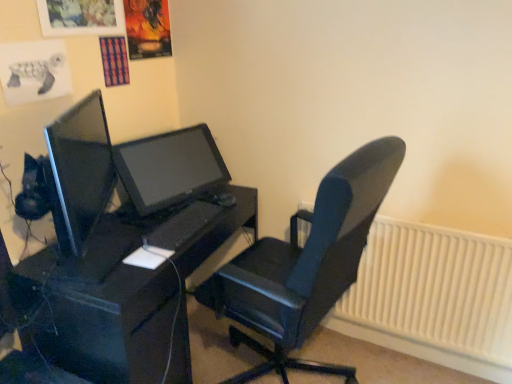
Identify the location of black matte keyboard at center. (182, 226).

Measure the distance between point (106, 239) and camera.

The depth of point (106, 239) is 5.34 feet.

You are a GUI agent. You are given a task and a screenshot of the screen. Output one action in this format:
    pyautogui.click(x=<x>, y=<y>)
    Task: Click on the black matte desk at center
    
    Given the screenshot: What is the action you would take?
    pyautogui.click(x=119, y=299)

Locate an element on the screen. Image resolution: width=512 pixels, height=384 pixels. white plastic radiator at lower right is located at coordinates (432, 295).

Is black matte desk at center oriented towards black leather chair at center?

Yes, black matte desk at center is turned towards black leather chair at center.

Which object is thinner, black matte desk at center or black leather chair at center?

With smaller width is black matte desk at center.

Is black matte desk at center at the left side of black leather chair at center?

Indeed, black matte desk at center is positioned on the left side of black leather chair at center.

Which of these two, matte black monitor at center or black leather chair at center, is wider?

With larger width is black leather chair at center.

Considering the positions of points (148, 165) and (264, 244), is point (148, 165) closer to camera compared to point (264, 244)?

Yes, it is.

Looking at this image, is matte black monitor at center not close to black leather chair at center?

matte black monitor at center is actually quite close to black leather chair at center.

Considering the positions of objects matte black monitor at center and black leather chair at center in the image provided, who is behind, matte black monitor at center or black leather chair at center?

matte black monitor at center is behind.

Considering the sizes of objects black matte desk at center and matte black monitor at center in the image provided, who is smaller, black matte desk at center or matte black monitor at center?

With smaller size is matte black monitor at center.

Is black matte desk at center aimed at matte black monitor at center?

No, black matte desk at center is not oriented towards matte black monitor at center.

Would you say black matte desk at center is outside matte black monitor at center?

Yes, black matte desk at center is outside of matte black monitor at center.

Is white plastic radiator at lower right at the back of matte black monitor at center?

No, matte black monitor at center is not facing away from white plastic radiator at lower right.

Is matte black monitor at center far from white plastic radiator at lower right?

matte black monitor at center is positioned a significant distance from white plastic radiator at lower right.

Is matte black monitor at center taller or shorter than white plastic radiator at lower right?

Considering their sizes, matte black monitor at center has less height than white plastic radiator at lower right.

Is the position of matte black monitor at center less distant than that of white plastic radiator at lower right?

That is True.

Is white plastic radiator at lower right wider or thinner than black matte desk at center?

In the image, white plastic radiator at lower right appears to be more narrow than black matte desk at center.

Which point is more distant from viewer, (426, 337) or (114, 378)?

The point (426, 337) is behind.

From a real-world perspective, is white plastic radiator at lower right over black matte desk at center?

No, from a real-world perspective, white plastic radiator at lower right is not on top of black matte desk at center.

This screenshot has width=512, height=384. Identify the location of chair that is on the left side of white plastic radiator at lower right. (304, 265).

Based on the photo, which of these two, white plastic radiator at lower right or black leather chair at center, stands shorter?

white plastic radiator at lower right.

Is point (497, 355) more distant than point (343, 160)?

Yes, it is.

Consider the image. How distant is white plastic radiator at lower right from black leather chair at center?

white plastic radiator at lower right is 19.21 inches away from black leather chair at center.

From the image's perspective, which object appears higher, black leather chair at center or black matte desk at center?

black leather chair at center is shown above in the image.

Does black leather chair at center have a greater height compared to black matte desk at center?

Yes.

Can you tell me how much black leather chair at center and black matte desk at center differ in facing direction?

black leather chair at center and black matte desk at center are facing 172 degrees away from each other.

Does black leather chair at center come behind black matte desk at center?

No, black leather chair at center is closer to the viewer.

Find the location of a particular element. desk behind the black leather chair at center is located at coordinates click(119, 299).

Where is `computer monitor above the black leather chair at center (from a real-world perspective)`? This screenshot has width=512, height=384. computer monitor above the black leather chair at center (from a real-world perspective) is located at coordinates (169, 168).

When comparing their distances from black matte keyboard at center, does matte black monitor at center or black leather chair at center seem further?

black leather chair at center lies further to black matte keyboard at center than the other object.

From the image, which object appears to be nearer to black leather chair at center, matte black monitor at center or white plastic radiator at lower right?

white plastic radiator at lower right is closer to black leather chair at center.

Considering their positions, is black matte keyboard at center positioned further to black leather chair at center than black matte desk at center?

Based on the image, black matte keyboard at center appears to be further to black leather chair at center.

Considering their positions, is black matte keyboard at center positioned closer to black matte desk at center than matte black monitor at center?

black matte keyboard at center lies closer to black matte desk at center than the other object.

From the picture: Estimate the real-world distances between objects in this image. Which object is closer to white plastic radiator at lower right, black matte keyboard at center or black leather chair at center?

black leather chair at center lies closer to white plastic radiator at lower right than the other object.

Based on their spatial positions, is white plastic radiator at lower right or black leather chair at center further from matte black monitor at center?

white plastic radiator at lower right.

Considering their positions, is black matte desk at center positioned further to black matte keyboard at center than black leather chair at center?

black leather chair at center is further to black matte keyboard at center.

From the image, which object appears to be nearer to white plastic radiator at lower right, black leather chair at center or black matte desk at center?

The object closer to white plastic radiator at lower right is black leather chair at center.

Locate an element on the screen. The height and width of the screenshot is (384, 512). computer monitor situated between black matte desk at center and white plastic radiator at lower right from left to right is located at coordinates (169, 168).

This screenshot has height=384, width=512. I want to click on chair between black matte keyboard at center and white plastic radiator at lower right in the horizontal direction, so click(304, 265).

Where is `keyboard located between matte black monitor at center and black leather chair at center in the left-right direction`? This screenshot has width=512, height=384. keyboard located between matte black monitor at center and black leather chair at center in the left-right direction is located at coordinates (182, 226).

The image size is (512, 384). I want to click on keyboard located between black matte desk at center and white plastic radiator at lower right in the left-right direction, so tap(182, 226).